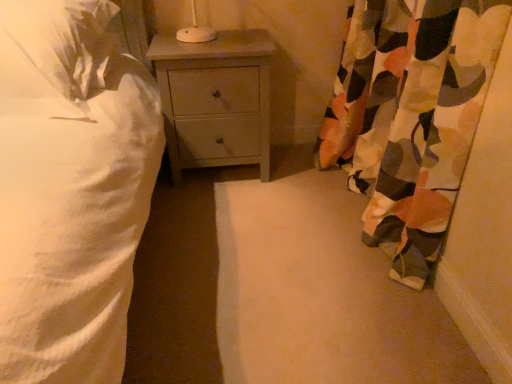
What do you see at coordinates (59, 37) in the screenshot?
I see `white soft pillow at upper left` at bounding box center [59, 37].

In order to face white soft pillow at upper left, should I rotate leftwards or rightwards?

To face it directly, rotate left by 28.212 degrees.

Locate an element on the screen. This screenshot has height=384, width=512. camouflage fabric curtain at right is located at coordinates (410, 117).

Could you tell me if white soft pillow at upper left is turned towards light gray wood nightstand at center?

No, white soft pillow at upper left does not turn towards light gray wood nightstand at center.

From a real-world perspective, who is located higher, white soft pillow at upper left or light gray wood nightstand at center?

From a 3D spatial view, white soft pillow at upper left is above.

Find the location of `nightstand beneath the white soft pillow at upper left (from a real-world perspective)`. nightstand beneath the white soft pillow at upper left (from a real-world perspective) is located at coordinates (215, 99).

From the image's perspective, is light gray wood nightstand at center located above white soft pillow at upper left?

No.

Can you confirm if light gray wood nightstand at center is wider than white soft pillow at upper left?

Incorrect, the width of light gray wood nightstand at center does not surpass that of white soft pillow at upper left.

In the scene shown: Would you consider light gray wood nightstand at center to be distant from white soft pillow at upper left?

No.

Considering the positions of objects light gray wood nightstand at center and camouflage fabric curtain at right in the image provided, who is more to the right, light gray wood nightstand at center or camouflage fabric curtain at right?

From the viewer's perspective, camouflage fabric curtain at right appears more on the right side.

Considering the sizes of objects light gray wood nightstand at center and camouflage fabric curtain at right in the image provided, who is shorter, light gray wood nightstand at center or camouflage fabric curtain at right?

light gray wood nightstand at center.

From a real-world perspective, is light gray wood nightstand at center positioned above or below camouflage fabric curtain at right?

From a real-world perspective, light gray wood nightstand at center is physically below camouflage fabric curtain at right.

Between light gray wood nightstand at center and camouflage fabric curtain at right, which one has smaller width?

camouflage fabric curtain at right is thinner.

How many degrees apart are the facing directions of camouflage fabric curtain at right and white soft pillow at upper left?

87.3 degrees.

Which object is thinner, camouflage fabric curtain at right or white soft pillow at upper left?

camouflage fabric curtain at right is thinner.

Is white soft pillow at upper left at the back of camouflage fabric curtain at right?

No, camouflage fabric curtain at right is not facing away from white soft pillow at upper left.

Is white soft pillow at upper left wider than camouflage fabric curtain at right?

Indeed, white soft pillow at upper left has a greater width compared to camouflage fabric curtain at right.

Identify the location of curtain in front of the white soft pillow at upper left. This screenshot has height=384, width=512. (410, 117).

From the image's perspective, would you say white soft pillow at upper left is shown under camouflage fabric curtain at right?

No, from the image's perspective, white soft pillow at upper left is not below camouflage fabric curtain at right.

Does white soft pillow at upper left have a smaller size compared to camouflage fabric curtain at right?

Yes, white soft pillow at upper left is smaller than camouflage fabric curtain at right.

Consider the image. Is light gray wood nightstand at center inside camouflage fabric curtain at right?

That's incorrect, light gray wood nightstand at center is not inside camouflage fabric curtain at right.

From the image's perspective, is camouflage fabric curtain at right positioned above or below light gray wood nightstand at center?

From the image's perspective, camouflage fabric curtain at right appears below light gray wood nightstand at center.

Is camouflage fabric curtain at right turned away from light gray wood nightstand at center?

camouflage fabric curtain at right is not turned away from light gray wood nightstand at center.

Considering the relative sizes of camouflage fabric curtain at right and light gray wood nightstand at center in the image provided, is camouflage fabric curtain at right thinner than light gray wood nightstand at center?

Correct, the width of camouflage fabric curtain at right is less than that of light gray wood nightstand at center.

This screenshot has width=512, height=384. In the image, there is a white soft pillow at upper left. Identify the location of nightstand below it (from a real-world perspective). (215, 99).

The image size is (512, 384). I want to click on pillow above the light gray wood nightstand at center (from a real-world perspective), so click(x=59, y=37).

From the image, which object appears to be farther from white soft pillow at upper left, light gray wood nightstand at center or camouflage fabric curtain at right?

The object further to white soft pillow at upper left is camouflage fabric curtain at right.

Estimate the real-world distances between objects in this image. Which object is closer to camouflage fabric curtain at right, white soft pillow at upper left or light gray wood nightstand at center?

light gray wood nightstand at center.

Considering their positions, is white soft pillow at upper left positioned closer to light gray wood nightstand at center than camouflage fabric curtain at right?

white soft pillow at upper left lies closer to light gray wood nightstand at center than the other object.

When comparing their distances from camouflage fabric curtain at right, does light gray wood nightstand at center or white soft pillow at upper left seem closer?

The object closer to camouflage fabric curtain at right is light gray wood nightstand at center.

Consider the image. When comparing their distances from light gray wood nightstand at center, does camouflage fabric curtain at right or white soft pillow at upper left seem further?

camouflage fabric curtain at right lies further to light gray wood nightstand at center than the other object.

When comparing their distances from white soft pillow at upper left, does camouflage fabric curtain at right or light gray wood nightstand at center seem further?

Among the two, camouflage fabric curtain at right is located further to white soft pillow at upper left.

Where is `nightstand between white soft pillow at upper left and camouflage fabric curtain at right`? This screenshot has height=384, width=512. nightstand between white soft pillow at upper left and camouflage fabric curtain at right is located at coordinates pos(215,99).